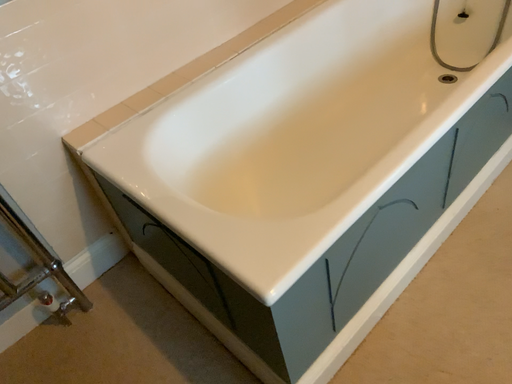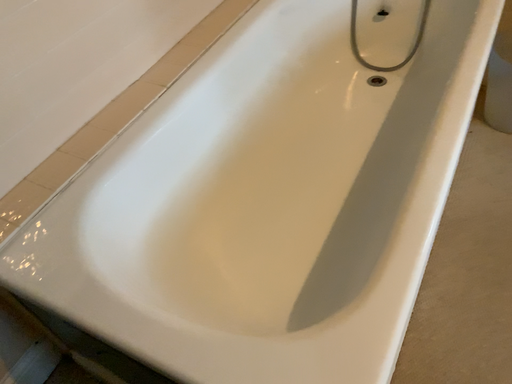
Question: How did the camera likely rotate when shooting the video?

Choices:
 (A) rotated right
 (B) rotated left

Answer: (A)